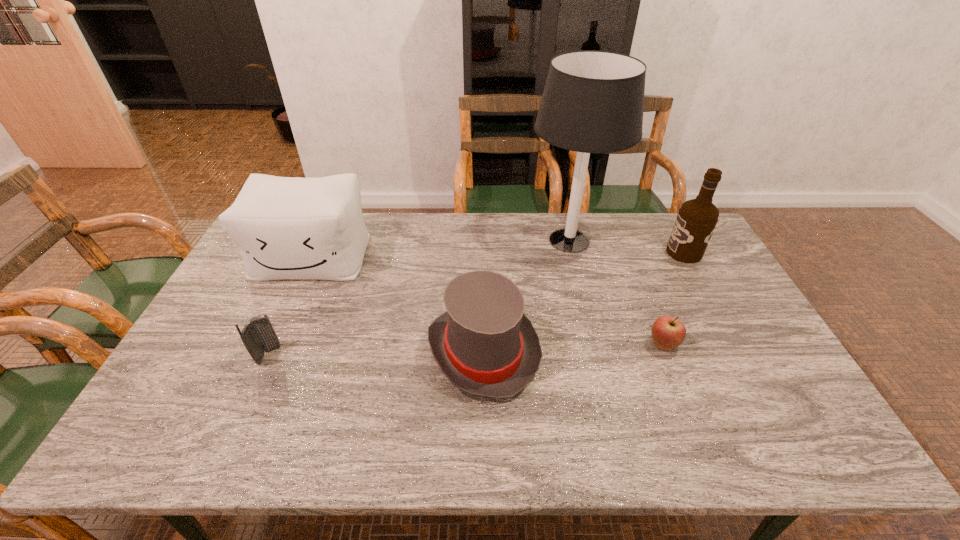
Identify the location of the tallest object. The image size is (960, 540). (593, 101).

Image resolution: width=960 pixels, height=540 pixels. I want to click on the rightmost object, so click(696, 220).

Identify the location of cushion. This screenshot has height=540, width=960. (286, 227).

The height and width of the screenshot is (540, 960). In order to click on dress hat in this screenshot , I will do `click(484, 344)`.

Image resolution: width=960 pixels, height=540 pixels. I want to click on cellular telephone, so click(258, 336).

In order to click on apple in this screenshot , I will do `click(667, 332)`.

This screenshot has height=540, width=960. Find the location of `vacant region located on the right of the table lamp`. vacant region located on the right of the table lamp is located at coordinates pos(667,241).

This screenshot has width=960, height=540. Find the location of `vacant region located on the label of the alcohol`. vacant region located on the label of the alcohol is located at coordinates (646, 253).

The width and height of the screenshot is (960, 540). What are the coordinates of `vacant space located 0.310m on the label of the alcohol` in the screenshot? It's located at (576, 253).

Find the location of a particular element. vacant space located 0.320m on the label of the alcohol is located at coordinates (573, 253).